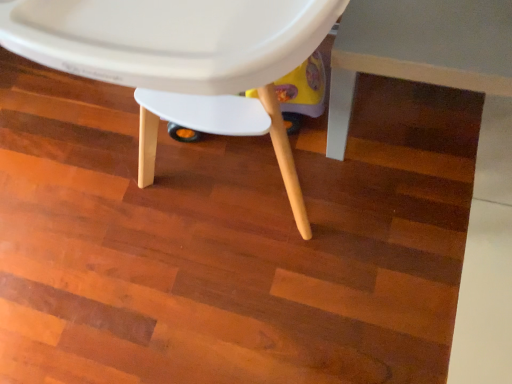
Question: In terms of width, does white matte table at lower right look wider or thinner when compared to white matte plastic chair at center?

Choices:
 (A) thin
 (B) wide

Answer: (A)

Question: Considering their positions, is white matte table at lower right located in front of or behind white matte plastic chair at center?

Choices:
 (A) front
 (B) behind

Answer: (B)

Question: In terms of height, does white matte table at lower right look taller or shorter compared to white matte plastic chair at center?

Choices:
 (A) tall
 (B) short

Answer: (B)

Question: From the image's perspective, is white matte plastic chair at center above or below white matte table at lower right?

Choices:
 (A) above
 (B) below

Answer: (A)

Question: From a real-world perspective, is white matte plastic chair at center above or below white matte table at lower right?

Choices:
 (A) below
 (B) above

Answer: (B)

Question: Considering the positions of point (295, 23) and point (329, 102), is point (295, 23) closer or farther from the camera than point (329, 102)?

Choices:
 (A) closer
 (B) farther

Answer: (A)

Question: In the image, is white matte plastic chair at center on the left side or the right side of white matte table at lower right?

Choices:
 (A) left
 (B) right

Answer: (A)